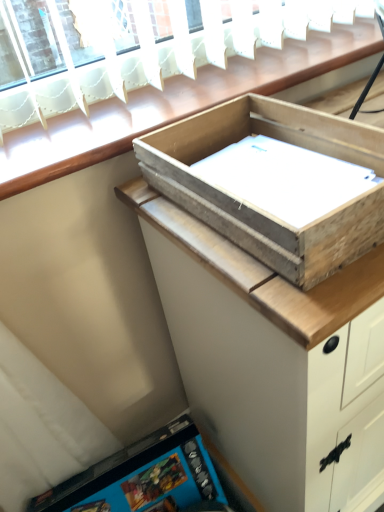
Question: Should I look upward or downward to see wooden tray at upper center?

Choices:
 (A) up
 (B) down

Answer: (B)

Question: Is weathered wood box at upper center positioned behind wooden tray at upper center?

Choices:
 (A) no
 (B) yes

Answer: (A)

Question: Is weathered wood box at upper center positioned far away from wooden tray at upper center?

Choices:
 (A) yes
 (B) no

Answer: (B)

Question: From a real-world perspective, is weathered wood box at upper center below wooden tray at upper center?

Choices:
 (A) yes
 (B) no

Answer: (B)

Question: From a real-world perspective, is weathered wood box at upper center on wooden tray at upper center?

Choices:
 (A) yes
 (B) no

Answer: (A)

Question: Is weathered wood box at upper center positioned with its back to wooden tray at upper center?

Choices:
 (A) no
 (B) yes

Answer: (A)

Question: Can you confirm if weathered wood box at upper center is thinner than wooden tray at upper center?

Choices:
 (A) yes
 (B) no

Answer: (A)

Question: Considering the relative positions of wooden tray at upper center and weathered wood box at upper center in the image provided, is wooden tray at upper center to the left of weathered wood box at upper center from the viewer's perspective?

Choices:
 (A) yes
 (B) no

Answer: (B)

Question: Can you confirm if wooden tray at upper center is positioned to the right of weathered wood box at upper center?

Choices:
 (A) no
 (B) yes

Answer: (B)

Question: Considering the relative sizes of wooden tray at upper center and weathered wood box at upper center in the image provided, is wooden tray at upper center wider than weathered wood box at upper center?

Choices:
 (A) yes
 (B) no

Answer: (A)

Question: Is wooden tray at upper center directly adjacent to weathered wood box at upper center?

Choices:
 (A) no
 (B) yes

Answer: (A)

Question: Does wooden tray at upper center contain weathered wood box at upper center?

Choices:
 (A) no
 (B) yes

Answer: (A)

Question: From the image's perspective, is wooden tray at upper center located above weathered wood box at upper center?

Choices:
 (A) yes
 (B) no

Answer: (B)

Question: Considering the positions of point (185, 150) and point (261, 330), is point (185, 150) closer or farther from the camera than point (261, 330)?

Choices:
 (A) farther
 (B) closer

Answer: (A)